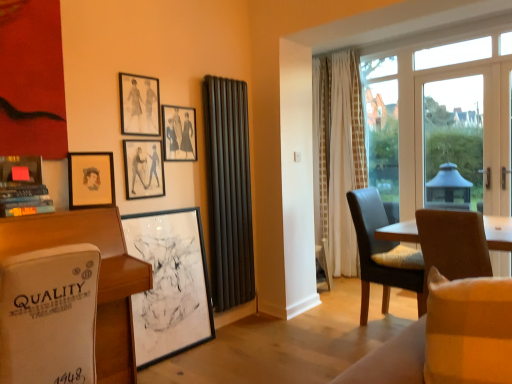
What do you see at coordinates (440, 343) in the screenshot?
I see `plush beige couch at lower right` at bounding box center [440, 343].

Identify the location of matte black picture frame at upper center, the 4th picture frame in the bottom-to-top sequence. The width and height of the screenshot is (512, 384). click(179, 133).

Measure the distance between matte black radiator at center, which appears as the 2th curtain when viewed from the back, and camera.

10.34 feet.

Measure the distance between matte black picture frame at upper left, arranged as the first picture frame when viewed from the top, and camera.

The depth of matte black picture frame at upper left, arranged as the first picture frame when viewed from the top, is 2.71 meters.

What is the approximate width of matte black picture frame at upper left, arranged as the first picture frame when viewed from the top?

It is 1.92 inches.

Locate an element on the screen. This screenshot has width=512, height=384. white sheer curtain at center, the 2th curtain from the left is located at coordinates (337, 154).

Where is `black matte picture frame at center, marked as the 1th picture frame in a bottom-to-top arrangement`? The width and height of the screenshot is (512, 384). black matte picture frame at center, marked as the 1th picture frame in a bottom-to-top arrangement is located at coordinates (169, 284).

The image size is (512, 384). What do you see at coordinates (169, 284) in the screenshot?
I see `black matte picture frame at center, marked as the 1th picture frame in a bottom-to-top arrangement` at bounding box center [169, 284].

What are the coordinates of `plush beige couch at lower right` in the screenshot? It's located at (440, 343).

Based on the photo, looking at their sizes, would you say transparent glass window at center, which ranks as the 1th window screen in back-to-front order, is wider or thinner than matte black radiator at center, the first curtain from the left?

In the image, transparent glass window at center, which ranks as the 1th window screen in back-to-front order, appears to be more narrow than matte black radiator at center, the first curtain from the left.

Which is closer, (384, 153) or (246, 258)?

Point (384, 153) appears to be farther away from the viewer than point (246, 258).

From a real-world perspective, starting from the transparent glass window at center, which is counted as the 2th window screen, starting from the front, which curtain is the 2nd one below it? Please provide its 2D coordinates.

[(229, 191)]

How different are the orientations of matte brown chair at right, which is the 1th chair from back to front, and black matte picture frame at upper center, which is the 3th picture frame in top-to-bottom order, in degrees?

There is a 3.02-degree angle between the facing directions of matte brown chair at right, which is the 1th chair from back to front, and black matte picture frame at upper center, which is the 3th picture frame in top-to-bottom order.

Is point (398, 286) positioned behind point (143, 160)?

That is True.

Is matte brown chair at right, placed as the 2th chair when sorted from front to back, not close to black matte picture frame at upper center, marked as the 3th picture frame in a bottom-to-top arrangement?

Yes, matte brown chair at right, placed as the 2th chair when sorted from front to back, and black matte picture frame at upper center, marked as the 3th picture frame in a bottom-to-top arrangement, are quite far apart.

Does matte brown chair at right, which is the 1th chair from back to front, turn towards black matte picture frame at upper center, which is the 3th picture frame in top-to-bottom order?

No, matte brown chair at right, which is the 1th chair from back to front, is not oriented towards black matte picture frame at upper center, which is the 3th picture frame in top-to-bottom order.

Between point (142, 79) and point (163, 162), which one is positioned in front?

Point (142, 79)

Is black matte picture frame at upper center, which is the 3th picture frame in top-to-bottom order, completely or partially inside matte black picture frame at upper left, arranged as the first picture frame when viewed from the top?

No.

From a real-world perspective, between matte black picture frame at upper left, the 5th picture frame in the bottom-to-top sequence, and black matte picture frame at upper center, which is the 3th picture frame in top-to-bottom order, who is vertically lower?

black matte picture frame at upper center, which is the 3th picture frame in top-to-bottom order, is physically lower.

Is matte black picture frame at upper center, the 2th picture frame viewed from the top, completely or partially inside black matte picture frame at center, marked as the 1th picture frame in a bottom-to-top arrangement?

No, black matte picture frame at center, marked as the 1th picture frame in a bottom-to-top arrangement, does not contain matte black picture frame at upper center, the 2th picture frame viewed from the top.

From a real-world perspective, is black matte picture frame at center, marked as the 1th picture frame in a bottom-to-top arrangement, above or below matte black picture frame at upper center, the 4th picture frame in the bottom-to-top sequence?

In terms of real-world spatial position, black matte picture frame at center, marked as the 1th picture frame in a bottom-to-top arrangement, is below matte black picture frame at upper center, the 4th picture frame in the bottom-to-top sequence.

In the scene shown: Which point is more distant from viewer, (x=145, y=324) or (x=177, y=111)?

Positioned behind is point (x=177, y=111).

Does black matte picture frame at center, which is counted as the 5th picture frame, starting from the top, appear on the left side of matte black picture frame at upper center, the 4th picture frame in the bottom-to-top sequence?

Correct, you'll find black matte picture frame at center, which is counted as the 5th picture frame, starting from the top, to the left of matte black picture frame at upper center, the 4th picture frame in the bottom-to-top sequence.

Would you say matte black picture frame at upper left, the 5th picture frame in the bottom-to-top sequence, is to the left or to the right of white sheer curtain at center, which is counted as the 1th curtain, starting from the right, in the picture?

A: matte black picture frame at upper left, the 5th picture frame in the bottom-to-top sequence, is to the left of white sheer curtain at center, which is counted as the 1th curtain, starting from the right.

Is matte black picture frame at upper left, arranged as the first picture frame when viewed from the top, not close to white sheer curtain at center, which is the second curtain in front-to-back order?

Yes, matte black picture frame at upper left, arranged as the first picture frame when viewed from the top, and white sheer curtain at center, which is the second curtain in front-to-back order, are located far from each other.

Is matte black picture frame at upper left, arranged as the first picture frame when viewed from the top, behind white sheer curtain at center, which is counted as the 1th curtain, starting from the right?

No, matte black picture frame at upper left, arranged as the first picture frame when viewed from the top, is closer to the viewer.

Between transparent glass window at center, which is counted as the 2th window screen, starting from the front, and white sheer curtain at center, which is the second curtain in front-to-back order, which one appears on the left side from the viewer's perspective?

white sheer curtain at center, which is the second curtain in front-to-back order.

In the scene shown: Which object is closer to the camera taking this photo, transparent glass window at center, which is counted as the 2th window screen, starting from the front, or white sheer curtain at center, which is the second curtain in front-to-back order?

white sheer curtain at center, which is the second curtain in front-to-back order, is more forward.

Is transparent glass window at center, which ranks as the 1th window screen in back-to-front order, smaller than white sheer curtain at center, the 2th curtain from the left?

Indeed, transparent glass window at center, which ranks as the 1th window screen in back-to-front order, has a smaller size compared to white sheer curtain at center, the 2th curtain from the left.

Is black matte picture frame at upper center, marked as the 3th picture frame in a bottom-to-top arrangement, at the right side of white sheer curtain at center, which is the second curtain in front-to-back order?

In fact, black matte picture frame at upper center, marked as the 3th picture frame in a bottom-to-top arrangement, is to the left of white sheer curtain at center, which is the second curtain in front-to-back order.

Consider the image. Which point is more distant from viewer, (143,145) or (333,84)?

Point (333,84)

The width and height of the screenshot is (512, 384). Identify the location of the 1st curtain positioned below the black matte picture frame at upper center, which is the 3th picture frame in top-to-bottom order (from a real-world perspective). (337, 154).

Find the location of a particular element. The height and width of the screenshot is (384, 512). the 2nd curtain positioned below the transparent glass window at center, which is counted as the 2th window screen, starting from the front (from the image's perspective) is located at coordinates (229, 191).

Where is `picture frame that is the 2nd object above the matte brown chair at right, placed as the 2th chair when sorted from front to back (from a real-world perspective)`? The image size is (512, 384). picture frame that is the 2nd object above the matte brown chair at right, placed as the 2th chair when sorted from front to back (from a real-world perspective) is located at coordinates (143, 169).

Considering their positions, is matte black radiator at center, which appears as the 2th curtain when viewed from the back, positioned closer to black matte picture frame at upper center, marked as the 3th picture frame in a bottom-to-top arrangement, than plush beige couch at lower right?

matte black radiator at center, which appears as the 2th curtain when viewed from the back, is positioned closer to the anchor black matte picture frame at upper center, marked as the 3th picture frame in a bottom-to-top arrangement.

Based on their spatial positions, is matte black picture frame at upper left, arranged as the first picture frame when viewed from the top, or matte black picture frame at upper left, acting as the second picture frame starting from the bottom, closer to transparent glass window at center, which ranks as the 1th window screen in back-to-front order?

matte black picture frame at upper left, arranged as the first picture frame when viewed from the top, lies closer to transparent glass window at center, which ranks as the 1th window screen in back-to-front order, than the other object.

Considering their positions, is plush beige couch at lower right positioned closer to matte black picture frame at upper left, arranged as the first picture frame when viewed from the top, than black matte picture frame at upper center, marked as the 3th picture frame in a bottom-to-top arrangement?

The object closer to matte black picture frame at upper left, arranged as the first picture frame when viewed from the top, is black matte picture frame at upper center, marked as the 3th picture frame in a bottom-to-top arrangement.

Considering their positions, is plush beige couch at lower right positioned closer to transparent glass window at center, which is counted as the 2th window screen, starting from the front, than brown leather chair at right, the 1th chair from the front?

brown leather chair at right, the 1th chair from the front, is positioned closer to the anchor transparent glass window at center, which is counted as the 2th window screen, starting from the front.

Looking at this image, estimate the real-world distances between objects in this image. Which object is closer to white leather desk at lower left, matte black picture frame at upper left, acting as the second picture frame starting from the bottom, or matte black radiator at center, arranged as the second curtain when viewed from the right?

Based on the image, matte black picture frame at upper left, acting as the second picture frame starting from the bottom, appears to be nearer to white leather desk at lower left.

Based on the photo, estimate the real-world distances between objects in this image. Which object is further from white sheer curtain at center, the 2th curtain from the left, matte black picture frame at upper left, the 5th picture frame in the bottom-to-top sequence, or brown leather chair at right, the 1th chair from the front?

Among the two, matte black picture frame at upper left, the 5th picture frame in the bottom-to-top sequence, is located further to white sheer curtain at center, the 2th curtain from the left.

Which object lies further to the anchor point matte brown chair at right, placed as the 2th chair when sorted from front to back, white sheer curtain at center, the 2th curtain from the left, or transparent glass window at center, which is counted as the second window screen, starting from the right?

transparent glass window at center, which is counted as the second window screen, starting from the right, is further to matte brown chair at right, placed as the 2th chair when sorted from front to back.

Considering their positions, is brown leather chair at right, the 1th chair from the front, positioned closer to matte black picture frame at upper center, the 2th picture frame viewed from the top, than matte black picture frame at upper left, marked as the 4th picture frame in a top-to-bottom arrangement?

matte black picture frame at upper left, marked as the 4th picture frame in a top-to-bottom arrangement.

At what (x,y) coordinates should I click in order to perform the action: click on curtain between matte black picture frame at upper left, arranged as the first picture frame when viewed from the top, and white sheer curtain at center, which ranks as the 1th curtain in back-to-front order, from left to right. Please return your answer as a coordinate pair (x, y). The image size is (512, 384). Looking at the image, I should click on (229, 191).

Find the location of `curtain between plush beige couch at lower right and white sheer curtain at center, the 2th curtain from the left, from front to back`. curtain between plush beige couch at lower right and white sheer curtain at center, the 2th curtain from the left, from front to back is located at coordinates (229, 191).

At what (x,y) coordinates should I click in order to perform the action: click on chair situated between black matte picture frame at center, which is counted as the 5th picture frame, starting from the top, and brown leather chair at right, the 1th chair from the front, from left to right. Please return your answer as a coordinate pair (x, y). This screenshot has height=384, width=512. Looking at the image, I should click on (382, 253).

The height and width of the screenshot is (384, 512). I want to click on desk between plush beige couch at lower right and matte black picture frame at upper center, the 4th picture frame in the bottom-to-top sequence, along the z-axis, so click(x=99, y=276).